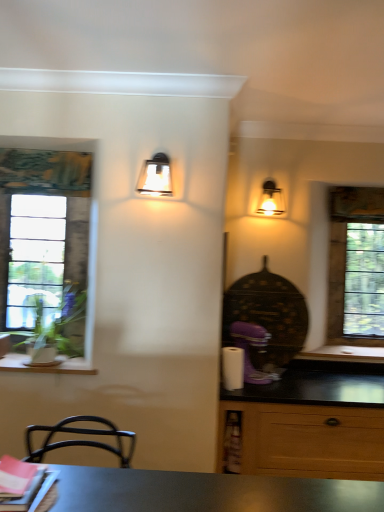
Question: Is metallic glass sconce at upper center, acting as the second lamp starting from the right, to the right of matte glass sconce at upper right, the first lamp viewed from the back, from the viewer's perspective?

Choices:
 (A) yes
 (B) no

Answer: (B)

Question: Does metallic glass sconce at upper center, marked as the first lamp in a left-to-right arrangement, have a larger size compared to matte glass sconce at upper right, the first lamp viewed from the back?

Choices:
 (A) yes
 (B) no

Answer: (A)

Question: Could you tell me if metallic glass sconce at upper center, which appears as the first lamp when viewed from the front, is turned towards matte glass sconce at upper right, the second lamp in the front-to-back sequence?

Choices:
 (A) no
 (B) yes

Answer: (A)

Question: Is metallic glass sconce at upper center, which is the second lamp in back-to-front order, wider than matte glass sconce at upper right, the first lamp viewed from the right?

Choices:
 (A) no
 (B) yes

Answer: (B)

Question: From a real-world perspective, is metallic glass sconce at upper center, marked as the first lamp in a left-to-right arrangement, physically below matte glass sconce at upper right, the second lamp in the front-to-back sequence?

Choices:
 (A) no
 (B) yes

Answer: (B)

Question: Considering the relative positions of metallic glass sconce at upper center, marked as the first lamp in a left-to-right arrangement, and matte glass sconce at upper right, the first lamp viewed from the back, in the image provided, is metallic glass sconce at upper center, marked as the first lamp in a left-to-right arrangement, to the left of matte glass sconce at upper right, the first lamp viewed from the back, from the viewer's perspective?

Choices:
 (A) yes
 (B) no

Answer: (A)

Question: Considering the relative sizes of wooden at left and clear glass window at left, marked as the first window in a left-to-right arrangement, in the image provided, is wooden at left bigger than clear glass window at left, marked as the first window in a left-to-right arrangement,?

Choices:
 (A) no
 (B) yes

Answer: (A)

Question: From a real-world perspective, is wooden at left located higher than clear glass window at left, the 2th window when ordered from right to left?

Choices:
 (A) no
 (B) yes

Answer: (A)

Question: Can you confirm if wooden at left is shorter than clear glass window at left, the 2th window positioned from the back?

Choices:
 (A) yes
 (B) no

Answer: (A)

Question: From the image's perspective, is wooden at left located above clear glass window at left, the 2th window when ordered from right to left?

Choices:
 (A) yes
 (B) no

Answer: (B)

Question: Is wooden at left to the left of clear glass window at left, the 1th window when ordered from front to back, from the viewer's perspective?

Choices:
 (A) no
 (B) yes

Answer: (A)

Question: Is wooden at left with clear glass window at left, marked as the first window in a left-to-right arrangement?

Choices:
 (A) no
 (B) yes

Answer: (A)

Question: Considering the relative positions of matte glass sconce at upper right, which appears as the 2th lamp when viewed from the left, and clear glass window at left, the 2th window positioned from the back, in the image provided, is matte glass sconce at upper right, which appears as the 2th lamp when viewed from the left, to the right of clear glass window at left, the 2th window positioned from the back, from the viewer's perspective?

Choices:
 (A) no
 (B) yes

Answer: (B)